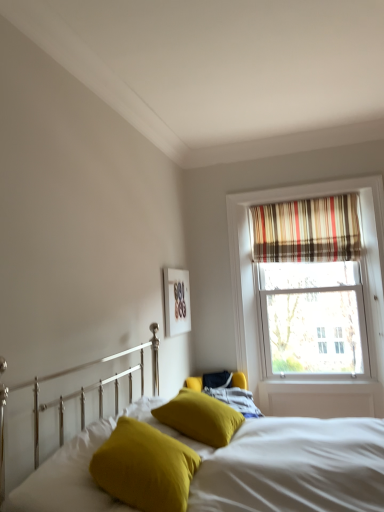
Question: Looking at the image, does velvety yellow pillow at lower left, which is the 1th pillow from left to right, seem bigger or smaller compared to velvet yellow pillows at center?

Choices:
 (A) big
 (B) small

Answer: (B)

Question: From the image's perspective, is velvety yellow pillow at lower left, which is the 1th pillow from left to right, positioned above or below velvet yellow pillows at center?

Choices:
 (A) above
 (B) below

Answer: (A)

Question: Based on their relative distances, which object is nearer to the velvet yellow pillows at center?

Choices:
 (A) mustard yellow fabric pillow at center, which is counted as the 1th pillow, starting from the right
 (B) velvety yellow pillow at lower left, which ranks as the 3th pillow in right-to-left order
 (C) matte white picture frame at upper center
 (D) striped fabric curtain at upper right
 (E) mustard yellow fabric pillow at lower center, which ranks as the second pillow in left-to-right order

Answer: (A)

Question: Based on their relative distances, which object is farther from the striped fabric curtain at upper right?

Choices:
 (A) mustard yellow fabric pillow at lower center, which ranks as the second pillow in left-to-right order
 (B) mustard yellow fabric pillow at center, positioned as the 3th pillow in left-to-right order
 (C) matte white picture frame at upper center
 (D) velvety yellow pillow at lower left, which ranks as the 3th pillow in right-to-left order
 (E) velvet yellow pillows at center

Answer: (D)